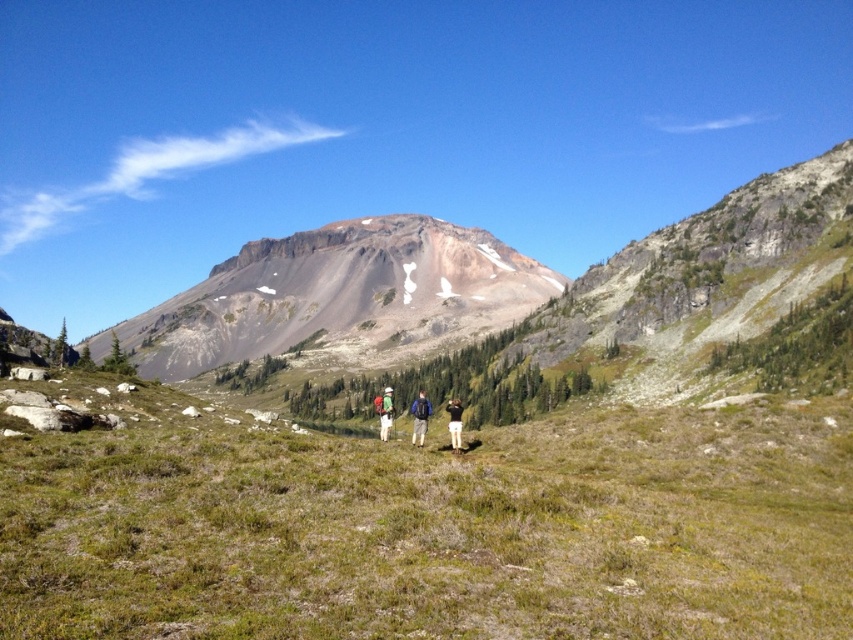
Question: Can you confirm if green grassy field at center is smaller than green fabric backpack at center?

Choices:
 (A) no
 (B) yes

Answer: (A)

Question: Does rustic brown mountain at center have a larger size compared to camouflage fabric backpacks at center?

Choices:
 (A) no
 (B) yes

Answer: (B)

Question: Among these points, which one is farthest from the camera?

Choices:
 (A) (390, 424)
 (B) (456, 451)

Answer: (A)

Question: Which point appears closest to the camera in this image?

Choices:
 (A) (36, 461)
 (B) (422, 397)
 (C) (450, 417)

Answer: (A)

Question: Observing the image, what is the correct spatial positioning of green grassy field at center in reference to black fabric person at center?

Choices:
 (A) below
 (B) above

Answer: (B)

Question: Which point appears closest to the camera in this image?

Choices:
 (A) (247, 266)
 (B) (456, 432)
 (C) (427, 417)

Answer: (B)